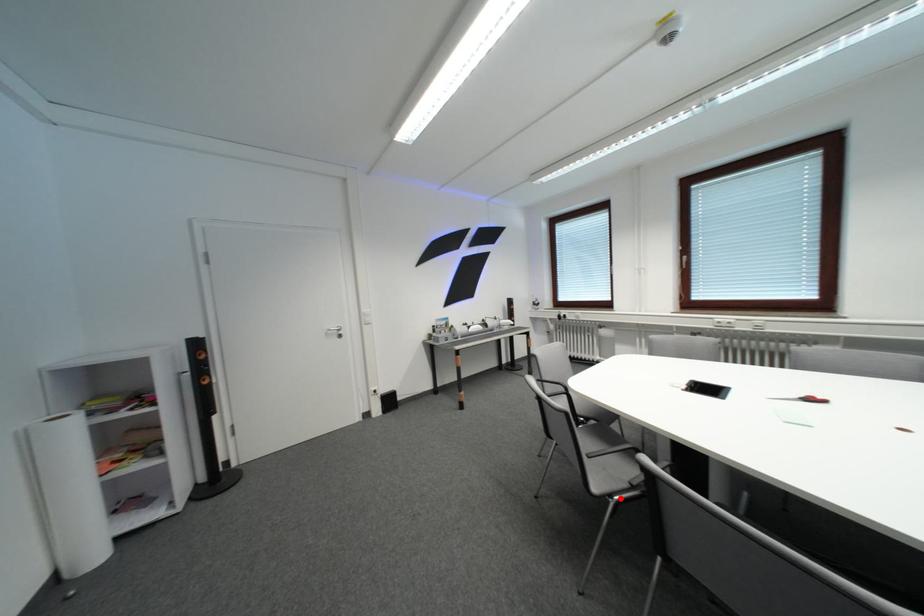
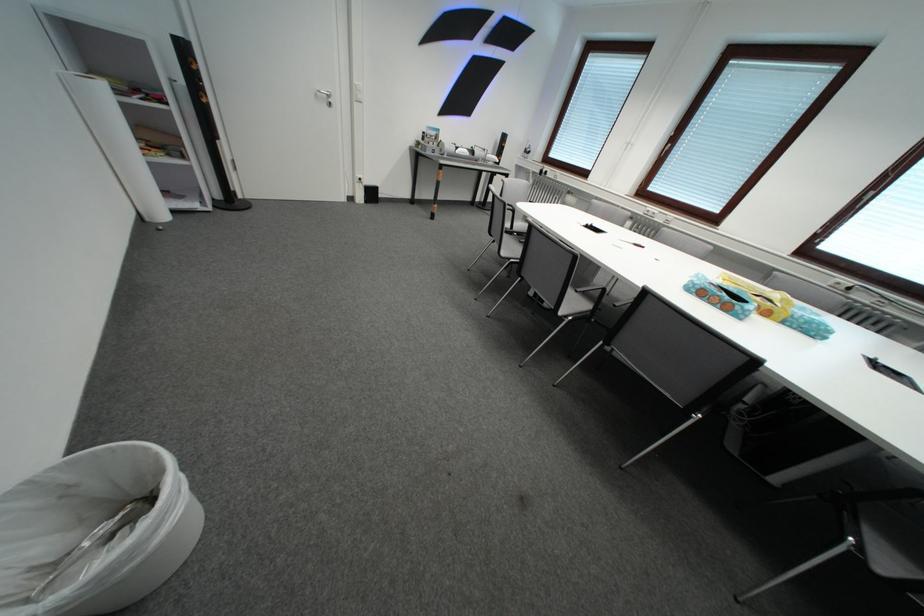
Question: I am providing you with two images of the same scene from different viewpoints. Image1 has a red point marked. In image2, the corresponding 3D location appears at what relative position? Reply with the corresponding letter.

Choices:
 (A) Closer
 (B) Farther

Answer: (A)